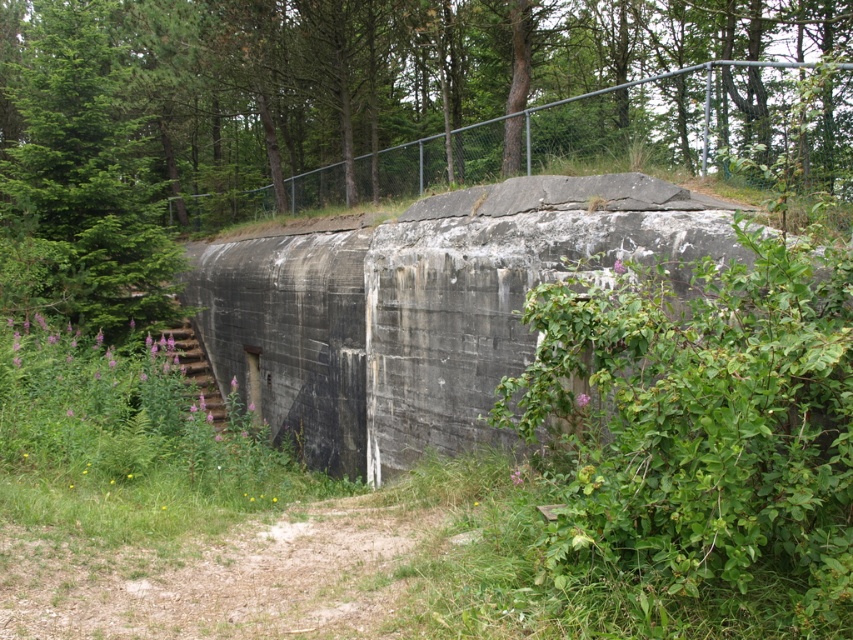
Is green leafy tree at center positioned at the back of gray concrete bunker at center?

Yes, it is behind gray concrete bunker at center.

Who is taller, green leafy tree at center or gray concrete bunker at center?

With more height is green leafy tree at center.

Where is `green leafy tree at center`? The height and width of the screenshot is (640, 853). green leafy tree at center is located at coordinates (331, 106).

Does point (381, 234) come in front of point (85, 48)?

Yes, it is.

Is gray concrete bunker at center bigger than green leafy tree at left?

Correct, gray concrete bunker at center is larger in size than green leafy tree at left.

Locate an element on the screen. The image size is (853, 640). gray concrete bunker at center is located at coordinates (421, 307).

In the scene shown: Can you confirm if green leafy tree at center is positioned to the right of green leafy tree at left?

Yes, green leafy tree at center is to the right of green leafy tree at left.

Is green leafy tree at center further to the viewer compared to green leafy tree at left?

That is False.

Is point (804, 45) closer to viewer compared to point (54, 140)?

No, it is not.

This screenshot has height=640, width=853. What are the coordinates of `green leafy tree at center` in the screenshot? It's located at (331, 106).